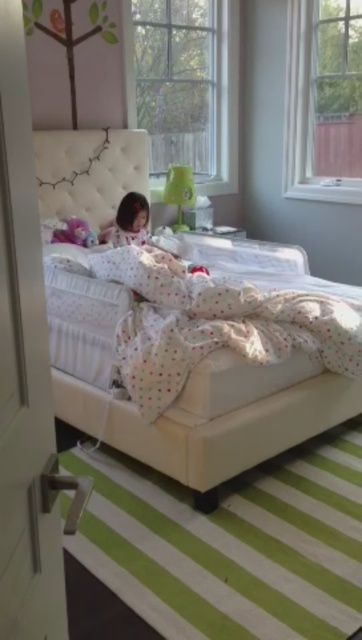
Is point (77, 385) less distant than point (136, 164)?

Yes, it is in front of point (136, 164).

The width and height of the screenshot is (362, 640). Describe the element at coordinates (203, 364) in the screenshot. I see `white tufted bed at center` at that location.

At what (x,y) coordinates should I click in order to perform the action: click on white tufted bed at center. Please return your answer as a coordinate pair (x, y). Looking at the image, I should click on (203, 364).

Is white tufted headboard at upper center positioned in front of soft plush toy at lower left?

Yes, it is.

Does white tufted headboard at upper center appear on the right side of soft plush toy at lower left?

Indeed, white tufted headboard at upper center is positioned on the right side of soft plush toy at lower left.

Is point (128, 140) less distant than point (94, 237)?

That is False.

I want to click on white tufted headboard at upper center, so click(x=89, y=172).

Between white tufted bed at center and soft plush toy at lower left, which one appears on the right side from the viewer's perspective?

white tufted bed at center

Which is behind, point (191, 310) or point (72, 225)?

Point (72, 225)

Does point (91, 433) come behind point (61, 240)?

No, it is in front of (61, 240).

Find the location of a particular element. This screenshot has width=362, height=640. white tufted bed at center is located at coordinates (203, 364).